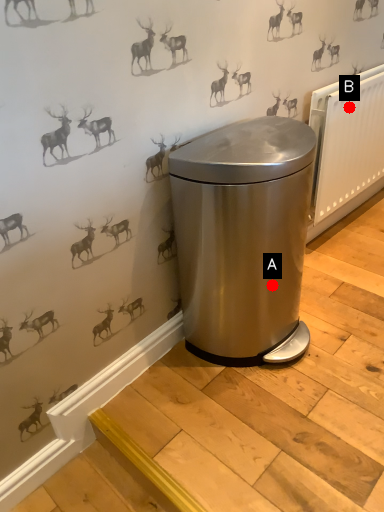
Question: Two points are circled on the image, labeled by A and B beside each circle. Which of the following is the farthest from the observer?

Choices:
 (A) A is further
 (B) B is further

Answer: (B)